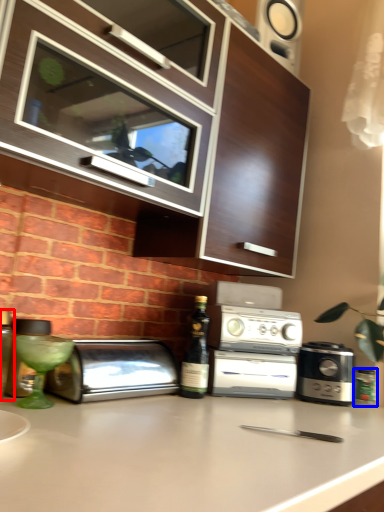
Question: Which of the following is the closest to the observer, bottle (highlighted by a red box) or bottle (highlighted by a blue box)?

Choices:
 (A) bottle
 (B) bottle

Answer: (A)